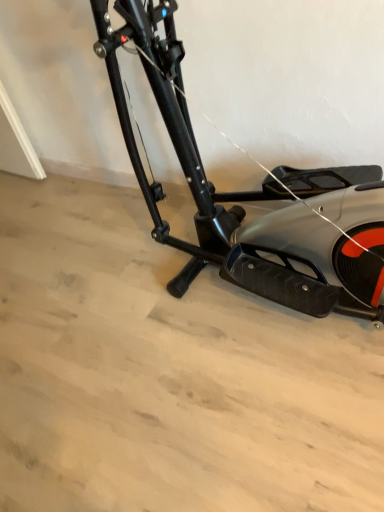
The width and height of the screenshot is (384, 512). Find the location of `free location in front of metallic silver elliptical trainer at center`. free location in front of metallic silver elliptical trainer at center is located at coordinates (241, 426).